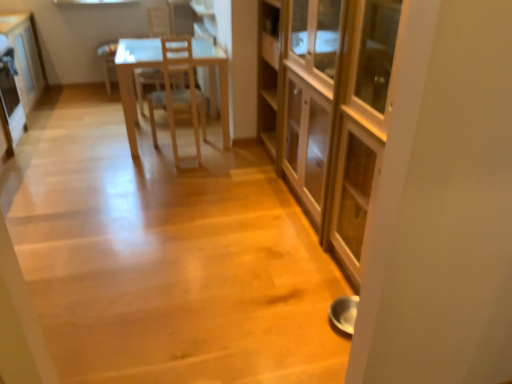
The height and width of the screenshot is (384, 512). I want to click on free space that is to the left of light brown wooden chair at center, so click(x=109, y=106).